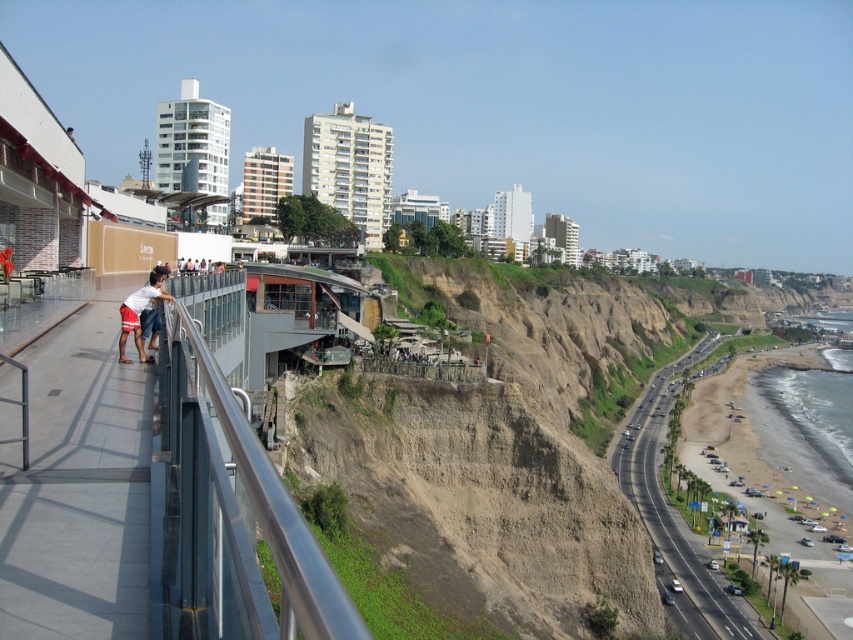
Question: Which of these objects is positioned farthest from the transparent glass railing at left?

Choices:
 (A) matte white shorts at left
 (B) asphalt road at lower right

Answer: (B)

Question: Among these points, which one is nearest to the camera?

Choices:
 (A) (705, 576)
 (B) (51, 540)
 (C) (248, 596)

Answer: (C)

Question: Considering the real-world distances, which object is closest to the transparent glass railing at left?

Choices:
 (A) smooth concrete walkway at left
 (B) matte white shorts at left
 (C) asphalt road at lower right

Answer: (A)

Question: Does transparent glass railing at left lie in front of matte white shorts at left?

Choices:
 (A) no
 (B) yes

Answer: (B)

Question: Does smooth concrete walkway at left appear over matte white shorts at left?

Choices:
 (A) yes
 (B) no

Answer: (B)

Question: Can you confirm if asphalt road at lower right is positioned to the left of matte white shorts at left?

Choices:
 (A) no
 (B) yes

Answer: (A)